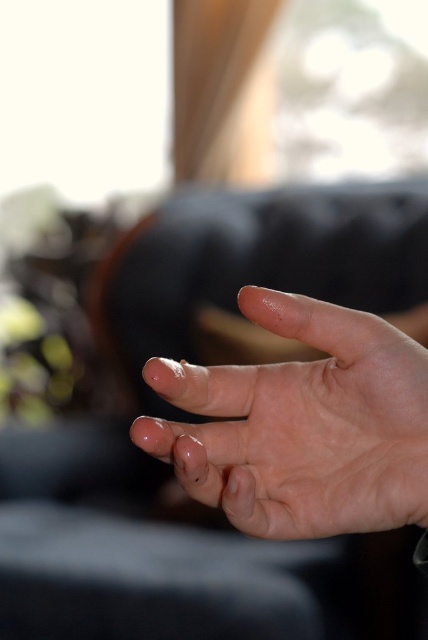
Can you confirm if smooth skin hand at center is wider than transparent gel toe at center?

Indeed, smooth skin hand at center has a greater width compared to transparent gel toe at center.

Image resolution: width=428 pixels, height=640 pixels. What do you see at coordinates (318, 422) in the screenshot? I see `smooth skin hand at center` at bounding box center [318, 422].

This screenshot has width=428, height=640. Identify the location of smooth skin hand at center. (318, 422).

Measure the distance from transparent gel toe at center to clear skin toe at center.

transparent gel toe at center and clear skin toe at center are 1.79 inches apart from each other.

Between transparent gel toe at center and clear skin toe at center, which one has more height?

With more height is transparent gel toe at center.

What do you see at coordinates (190, 461) in the screenshot? I see `transparent gel toe at center` at bounding box center [190, 461].

You are a GUI agent. You are given a task and a screenshot of the screen. Output one action in this format:
    pyautogui.click(x=<x>, y=<y>)
    Task: Click on the transparent gel toe at center
    The width and height of the screenshot is (428, 640).
    Given the screenshot: What is the action you would take?
    pyautogui.click(x=190, y=461)

Does translucent gel toe at center have a greater height compared to clear skin toe at center?

Yes.

Image resolution: width=428 pixels, height=640 pixels. What do you see at coordinates (154, 436) in the screenshot?
I see `translucent gel toe at center` at bounding box center [154, 436].

The image size is (428, 640). I want to click on translucent gel toe at center, so click(x=154, y=436).